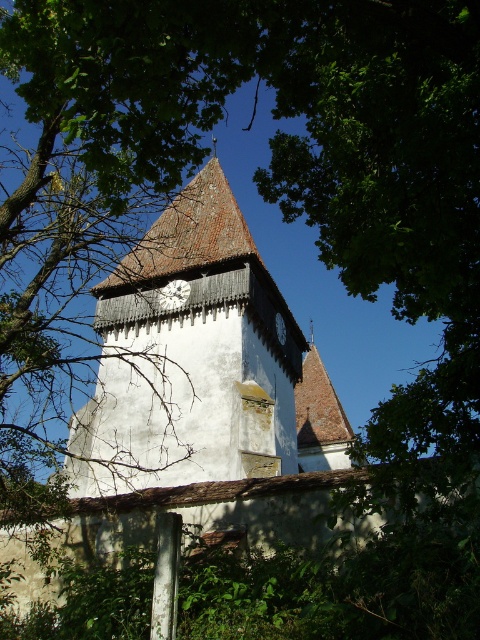
You are standing in front of the historic stone church tower and notice two white wooden clocks. Which clock is located higher up, the white wooden clock at center or the white wooden clock at upper center?

The white wooden clock at upper center is positioned higher up than the white wooden clock at center.